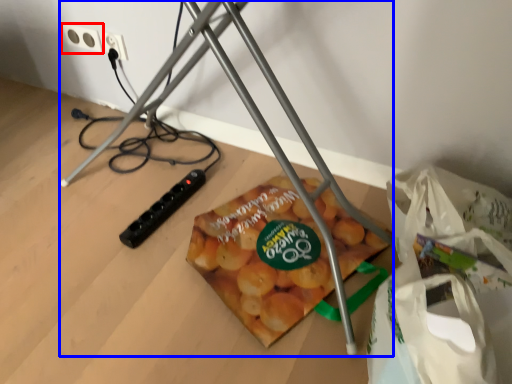
Question: Which point is further to the camera, power plugs and sockets (highlighted by a red box) or tripod (highlighted by a blue box)?

Choices:
 (A) power plugs and sockets
 (B) tripod

Answer: (A)